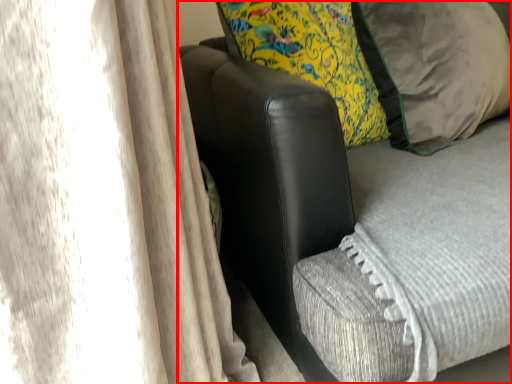
Question: Where is furniture (annotated by the red box) located in relation to pillow in the image?

Choices:
 (A) right
 (B) left

Answer: (B)